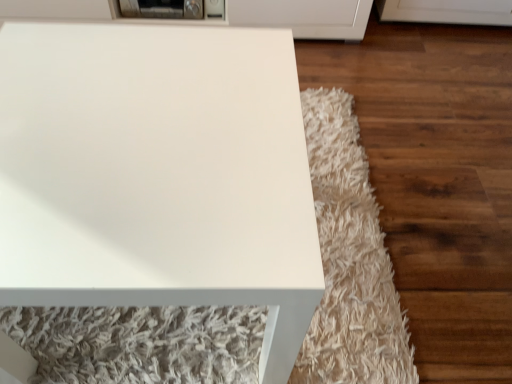
Find the location of a particular element. The image size is (512, 384). free point above white glossy table at center (from a real-world perspective) is located at coordinates (137, 110).